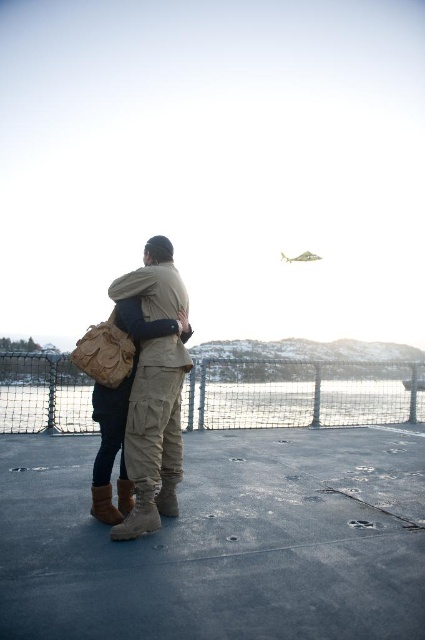
Which is in front, point (193, 362) or point (164, 474)?

Point (164, 474) is more forward.

Identify the location of wire mesh fence at center. This screenshot has width=425, height=640. (300, 394).

Image resolution: width=425 pixels, height=640 pixels. Describe the element at coordinates (300, 394) in the screenshot. I see `wire mesh fence at center` at that location.

You are a GUI agent. You are given a task and a screenshot of the screen. Output one action in this format:
    pyautogui.click(x=<x>, y=<y>)
    Task: Click on the wire mesh fence at center
    
    Given the screenshot: What is the action you would take?
    pyautogui.click(x=300, y=394)